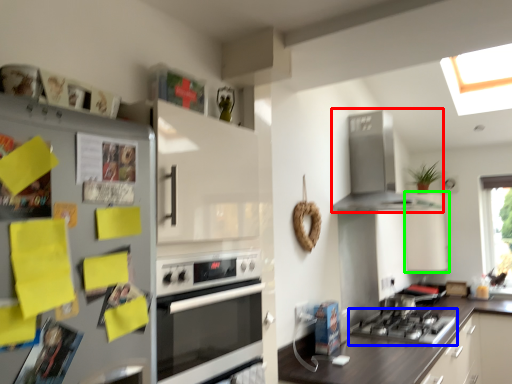
Question: Estimate the real-world distances between objects in this image. Which object is closer to home appliance (highlighted by a red box), gas stove (highlighted by a blue box) or cabinetry (highlighted by a green box)?

Choices:
 (A) gas stove
 (B) cabinetry

Answer: (B)